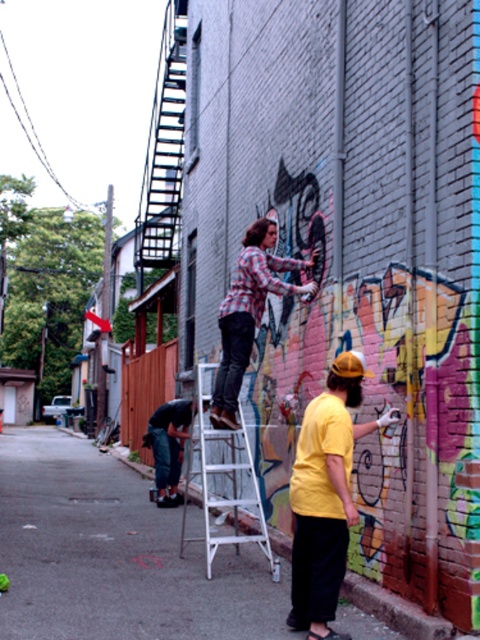
Question: Observing the image, what is the correct spatial positioning of white metal ladder at center in reference to denim pants at lower left?

Choices:
 (A) left
 (B) right

Answer: (B)

Question: Which point is farther to the camera?

Choices:
 (A) (35, 480)
 (B) (315, 548)
 (C) (265, 540)

Answer: (A)

Question: Which of these objects is positioned closest to the denim pants at lower left?

Choices:
 (A) yellow matte shirt at lower right
 (B) white metal ladder at center

Answer: (B)

Question: Estimate the real-world distances between objects in this image. Which object is farther from the denim pants at lower left?

Choices:
 (A) checkered fabric shirt at center
 (B) white metal ladder at center
 (C) matte white ladder at center

Answer: (A)

Question: Is matte white ladder at center to the left of white metal ladder at center from the viewer's perspective?

Choices:
 (A) yes
 (B) no

Answer: (A)

Question: Does matte white ladder at center lie behind yellow matte shirt at lower right?

Choices:
 (A) yes
 (B) no

Answer: (A)